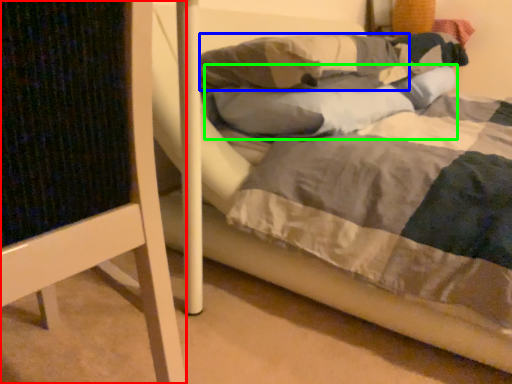
Question: Which is nearer to the furniture (highlighted by a red box)? pillow (highlighted by a blue box) or pillow (highlighted by a green box).

Choices:
 (A) pillow
 (B) pillow

Answer: (B)